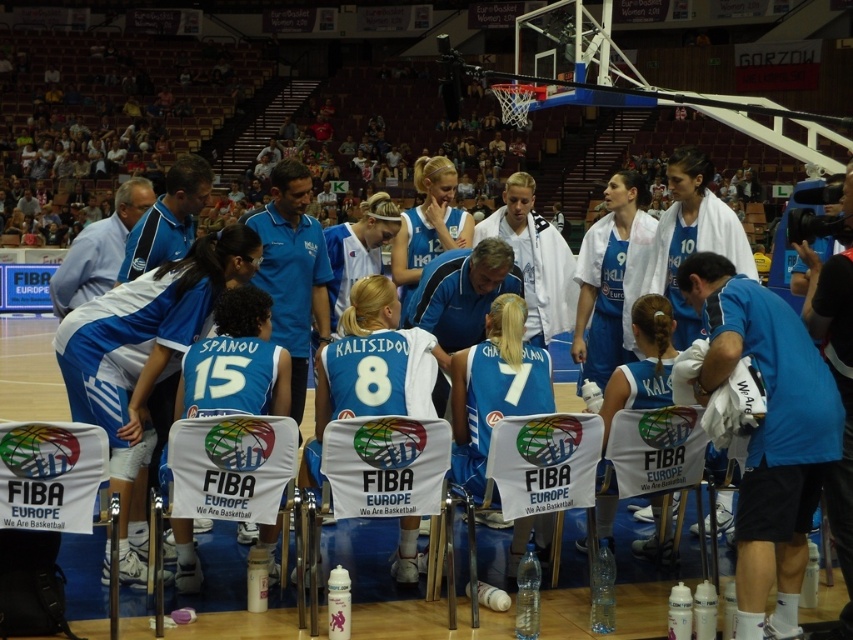
You are a spectator at the game and want to take a photo of the white jersey at center. The arena has a rule that photos can only be taken if the jersey is within the central 30x30 cm area of the camera frame. Based on the jersey being at coordinates point 0.552, 0.170, will your photo comply with the arena rules?

The white jersey at center is located at point (144, 353), which falls within the central 30x30 cm area of the camera frame, so the photo will comply with the arena rules.

You are a photographer positioned at the back of the arena and want to take a clear photo of the white jersey at center and the matte blue jersey at center during the huddle. Which jersey will be more visible in your photo?

The white jersey at center is in front of the matte blue jersey at center, so it will be more visible in the photo.